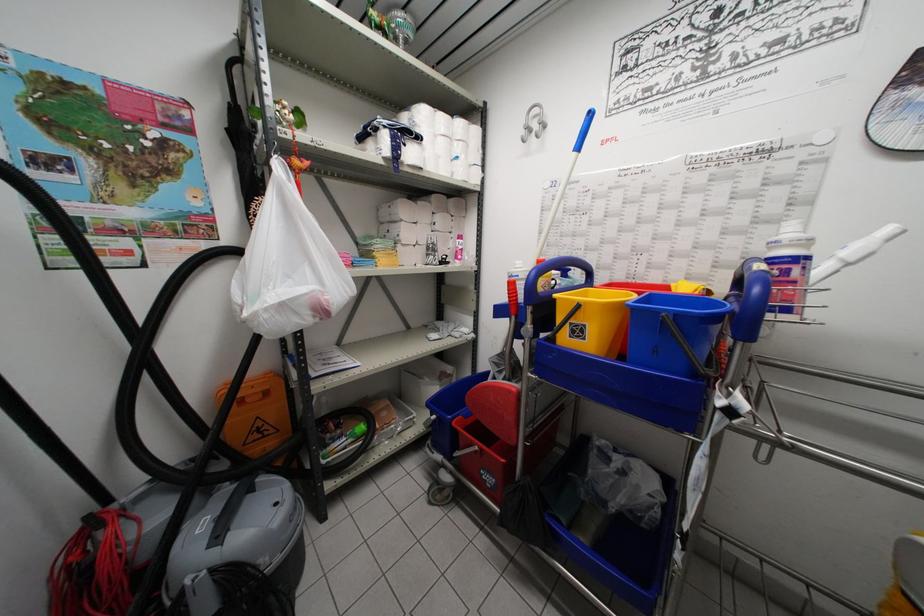
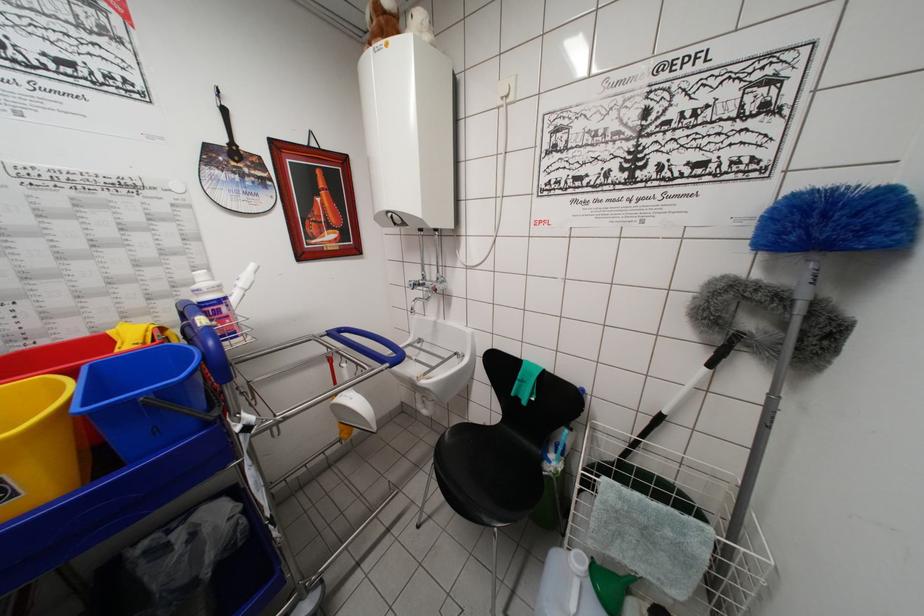
In the second image, find the point that corresponds to [662,315] in the first image.

(136, 405)